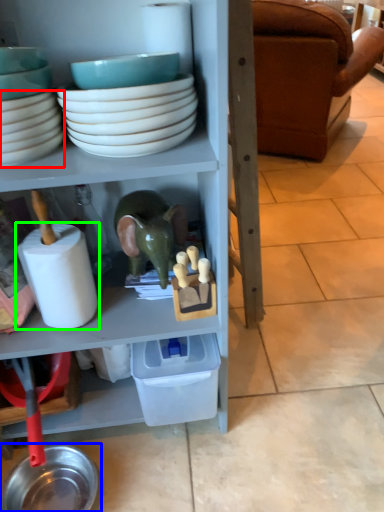
Question: Based on their relative distances, which object is farther from bowl (highlighted by a red box)? Choose from tableware (highlighted by a blue box) and toilet paper (highlighted by a green box).

Choices:
 (A) tableware
 (B) toilet paper

Answer: (A)